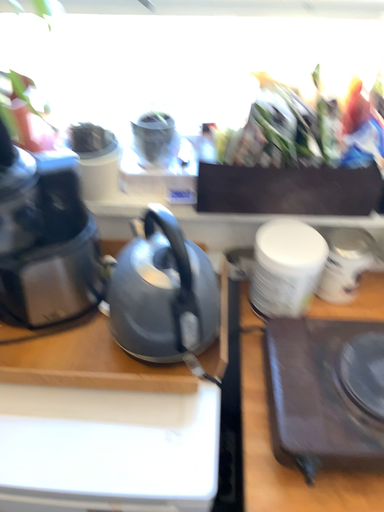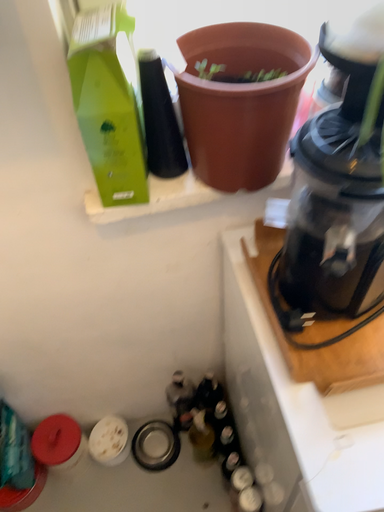
Question: How did the camera likely rotate when shooting the video?

Choices:
 (A) rotated right
 (B) rotated left

Answer: (A)